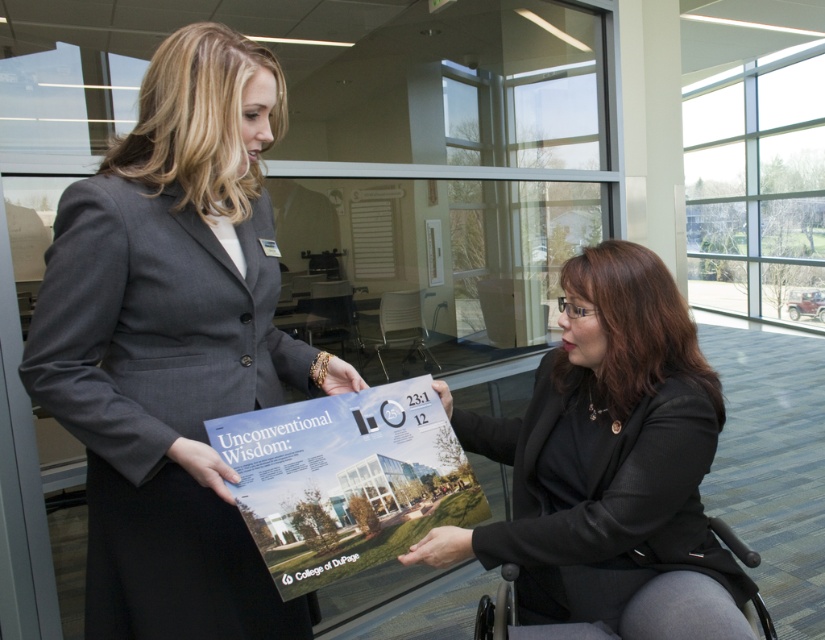
Can you confirm if black textured blazer at center is positioned below matte paper poster at center?

Actually, black textured blazer at center is above matte paper poster at center.

Is black textured blazer at center bigger than matte paper poster at center?

Indeed, black textured blazer at center has a larger size compared to matte paper poster at center.

Is point (597, 282) less distant than point (291, 492)?

No, (597, 282) is further to viewer.

I want to click on black textured blazer at center, so click(x=609, y=465).

Who is positioned more to the left, matte gray blazer at center or black plastic wheelchair at lower right?

From the viewer's perspective, matte gray blazer at center appears more on the left side.

Image resolution: width=825 pixels, height=640 pixels. What do you see at coordinates (173, 344) in the screenshot?
I see `matte gray blazer at center` at bounding box center [173, 344].

Does point (239, 280) come in front of point (762, 624)?

Yes, point (239, 280) is closer to viewer.

What are the coordinates of `matte gray blazer at center` in the screenshot? It's located at (173, 344).

Between point (257, 621) and point (378, 513), which one is positioned in front?

Point (378, 513)

Which is in front, point (192, 563) or point (318, 417)?

Point (192, 563)

The image size is (825, 640). Identify the location of matte gray blazer at center. (173, 344).